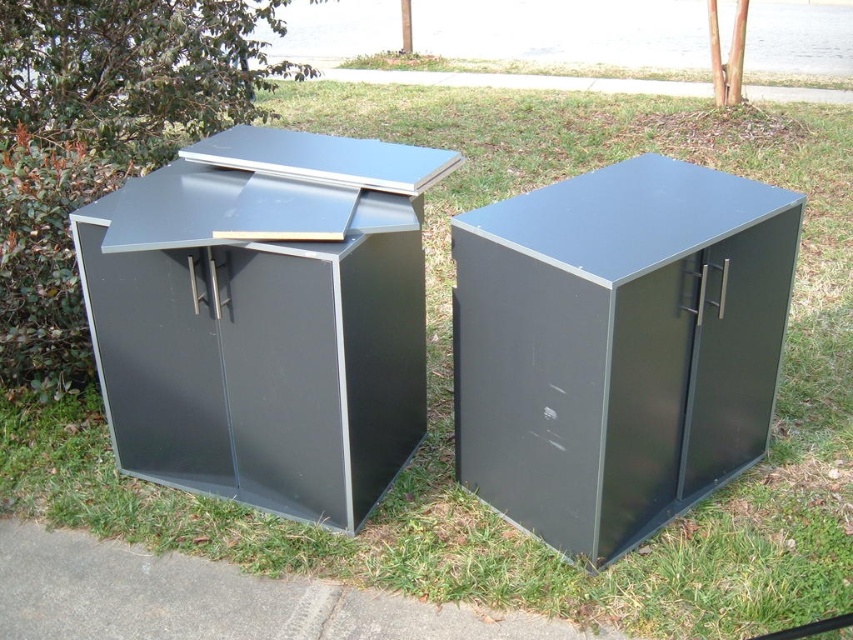
Question: Among these points, which one is nearest to the camera?

Choices:
 (A) (416, 220)
 (B) (379, 634)
 (C) (669, 483)

Answer: (B)

Question: Does matte black cabinet at center appear on the left side of gray concrete pavement at lower left?

Choices:
 (A) yes
 (B) no

Answer: (B)

Question: Where is matte black cabinet at left located in relation to gray concrete pavement at lower left in the image?

Choices:
 (A) below
 (B) above

Answer: (B)

Question: Which point is closer to the camera?

Choices:
 (A) gray concrete pavement at lower left
 (B) matte black cabinet at center

Answer: (B)

Question: Does matte black cabinet at center appear over gray concrete pavement at lower left?

Choices:
 (A) no
 (B) yes

Answer: (B)

Question: Which of the following is the closest to the observer?

Choices:
 (A) gray concrete pavement at lower left
 (B) matte black cabinet at center

Answer: (B)